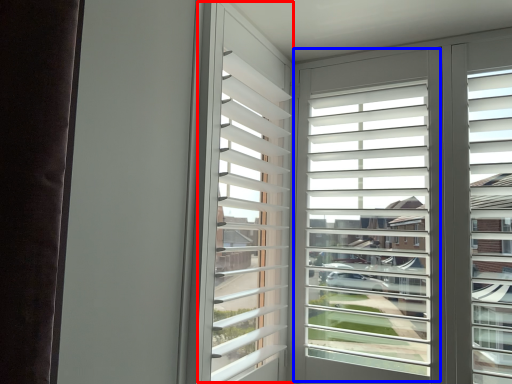
Question: Among these objects, which one is nearest to the camera, bay window (highlighted by a red box) or window screen (highlighted by a blue box)?

Choices:
 (A) bay window
 (B) window screen

Answer: (A)